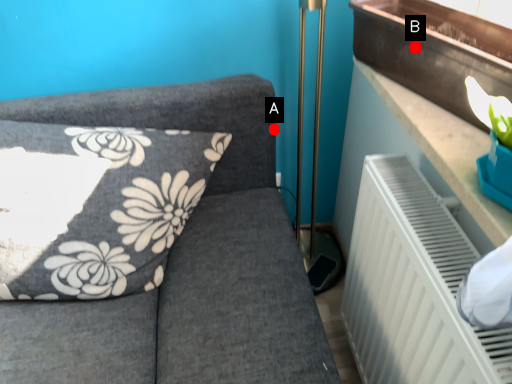
Question: Two points are circled on the image, labeled by A and B beside each circle. Which point appears closest to the camera in this image?

Choices:
 (A) A is closer
 (B) B is closer

Answer: (B)